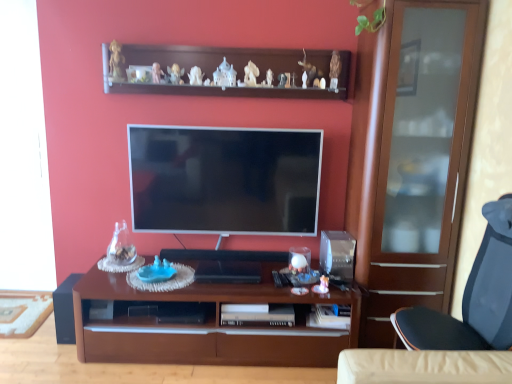
Locate an element on the screen. vacant space that is to the left of blue plastic toy at center is located at coordinates (117, 281).